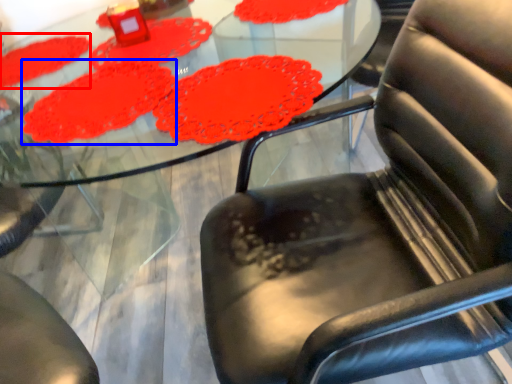
Question: Which point is further to the camera, mat (highlighted by a red box) or mat (highlighted by a blue box)?

Choices:
 (A) mat
 (B) mat

Answer: (A)